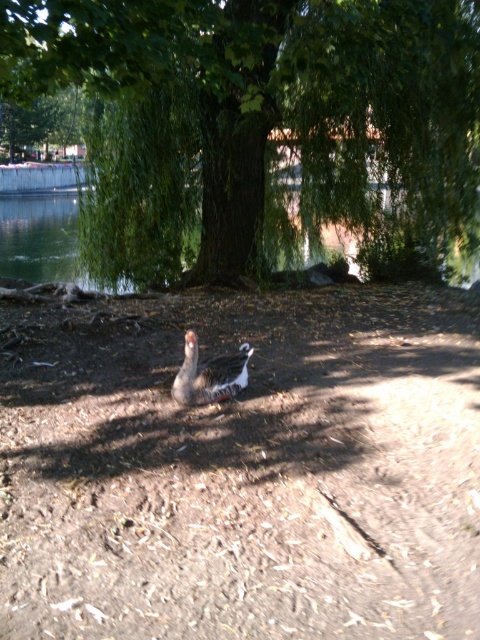
Can you confirm if green leafy water at center is shorter than speckled gray duck at center?

No.

Which is behind, point (68, 228) or point (202, 376)?

The point (68, 228) is behind.

Describe the element at coordinates (39, 236) in the screenshot. The width and height of the screenshot is (480, 640). I see `green leafy water at center` at that location.

Locate an element on the screen. green leafy water at center is located at coordinates (39, 236).

Does green leafy tree at center have a smaller size compared to green leafy water at center?

Yes, green leafy tree at center is smaller than green leafy water at center.

Is green leafy tree at center positioned before green leafy water at center?

Yes, it is in front of green leafy water at center.

What are the coordinates of `green leafy tree at center` in the screenshot? It's located at (255, 120).

Where is `green leafy tree at center`? The width and height of the screenshot is (480, 640). green leafy tree at center is located at coordinates (255, 120).

Between green leafy tree at center and speckled gray duck at center, which one is positioned higher?

green leafy tree at center

Between green leafy tree at center and speckled gray duck at center, which one appears on the right side from the viewer's perspective?

speckled gray duck at center is more to the right.

Find the location of `green leafy tree at center`. green leafy tree at center is located at coordinates (255, 120).

Find the location of a particular element. green leafy tree at center is located at coordinates (255, 120).